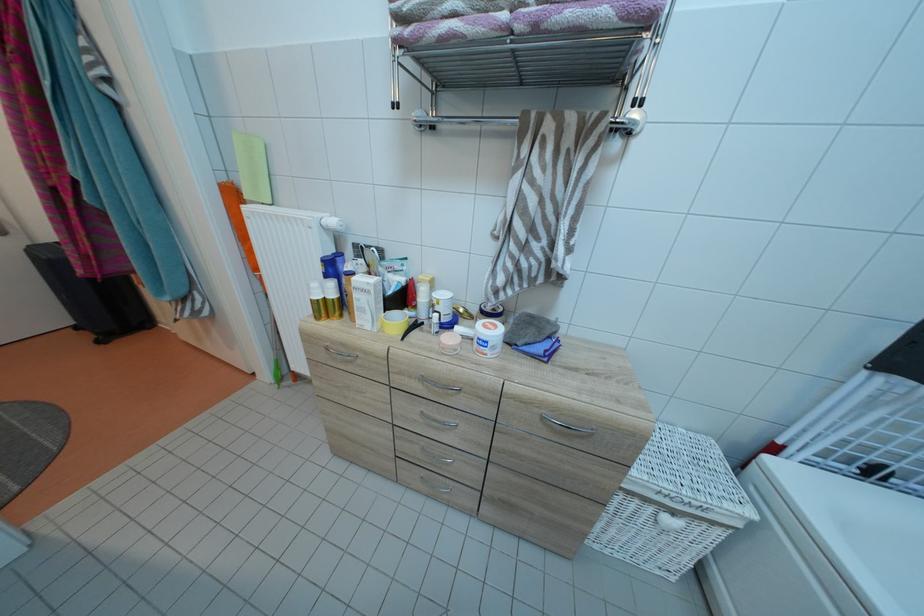
Where is `blue bottle`? blue bottle is located at coordinates (334, 270).